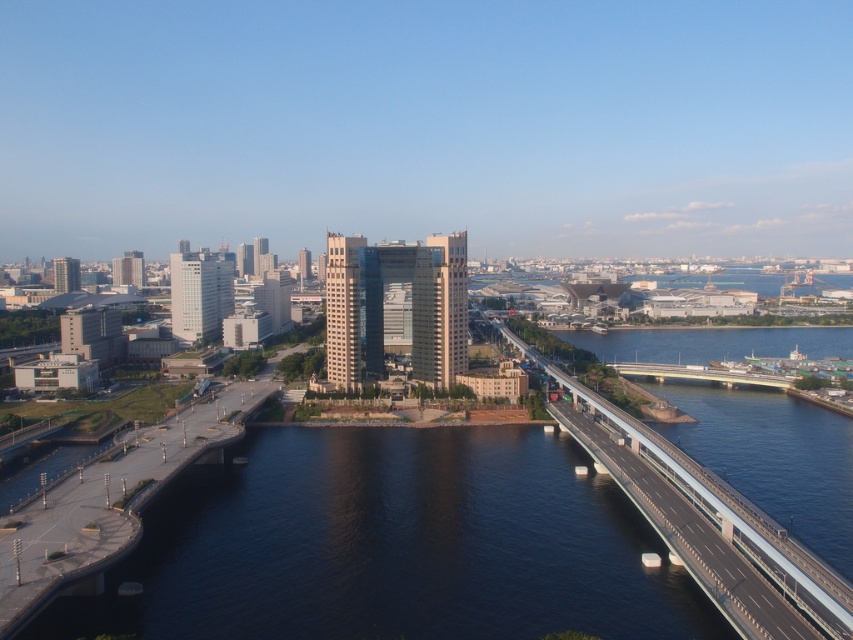
You are standing at the center of the image and want to reach both points, point (669, 481) and point (637, 369). Which point will you reach first?

Point (669, 481) is closer to the viewer than point (637, 369), so you will reach point (669, 481) first.

You are a drone operator tasked with capturing aerial footage of the concrete bridge at right. The drone has a maximum flight radius of 100 meters from your current position. Can you determine if the drone can reach the bridge without exceeding its flight radius?

The concrete bridge at right is located at point (705, 522), which is within the drone operator